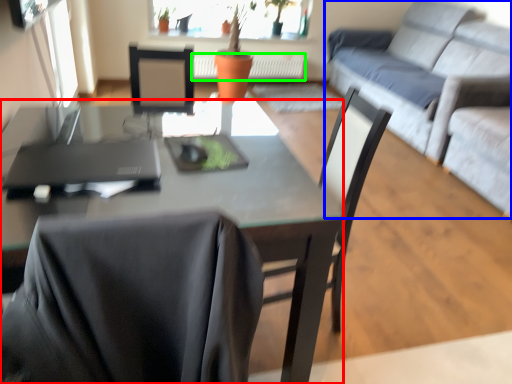
Question: Which object is positioned farthest from desk (highlighted by a red box)? Select from studio couch (highlighted by a blue box) and radiator (highlighted by a green box).

Choices:
 (A) studio couch
 (B) radiator

Answer: (B)